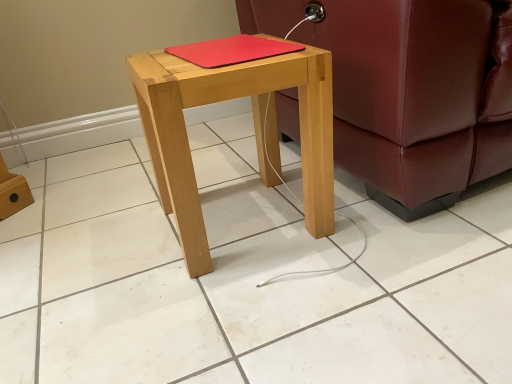
Identify the location of vacant area on top of natural wood stool at center (from a real-world perspective). pyautogui.click(x=217, y=53).